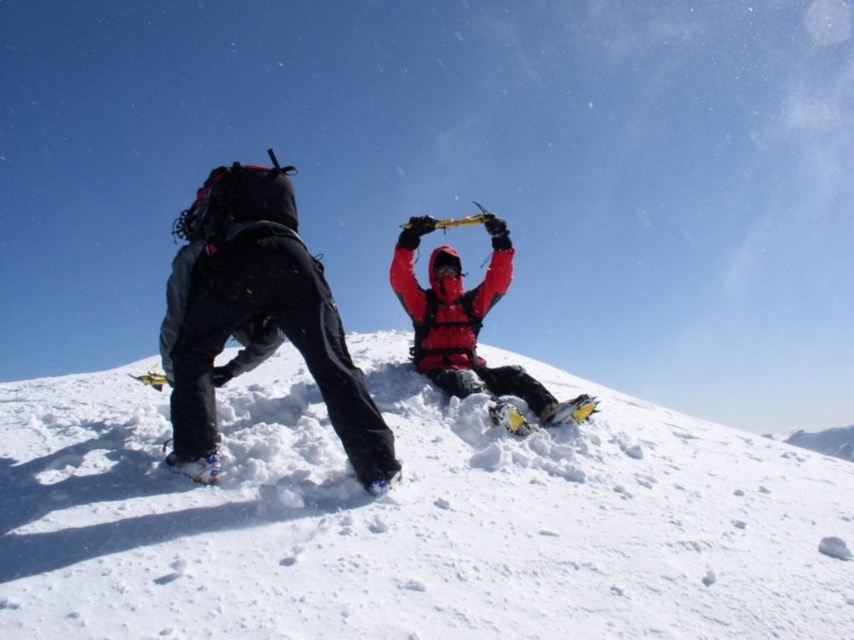
Does matte black pants at left appear over matte red jacket at center?

Actually, matte black pants at left is below matte red jacket at center.

Image resolution: width=854 pixels, height=640 pixels. What do you see at coordinates (256, 317) in the screenshot?
I see `matte black pants at left` at bounding box center [256, 317].

Find the location of `matte black pants at left`. matte black pants at left is located at coordinates (256, 317).

Is white fluffy snow at center behind matte black pants at left?

Yes, it is behind matte black pants at left.

How distant is white fluffy snow at center from matte black pants at left?

A distance of 1.18 meters exists between white fluffy snow at center and matte black pants at left.

What do you see at coordinates (410, 518) in the screenshot?
I see `white fluffy snow at center` at bounding box center [410, 518].

Locate an element on the screen. The height and width of the screenshot is (640, 854). white fluffy snow at center is located at coordinates (410, 518).

Can you confirm if white fluffy snow at center is positioned to the left of matte red jacket at center?

Yes, white fluffy snow at center is to the left of matte red jacket at center.

Does white fluffy snow at center have a lesser width compared to matte red jacket at center?

Yes, white fluffy snow at center is thinner than matte red jacket at center.

Is point (425, 630) in front of point (413, 228)?

Yes, point (425, 630) is closer to viewer.

Identify the location of white fluffy snow at center. (410, 518).